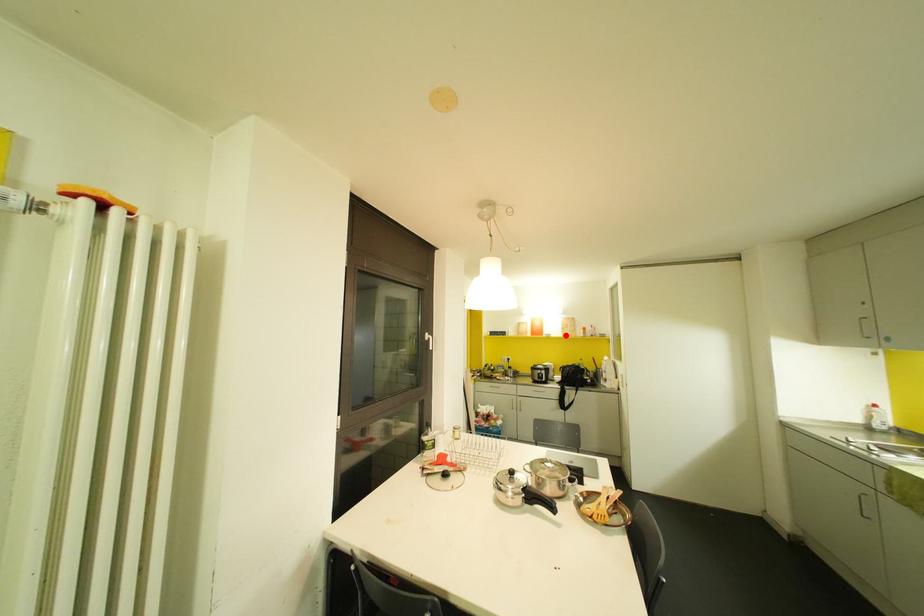
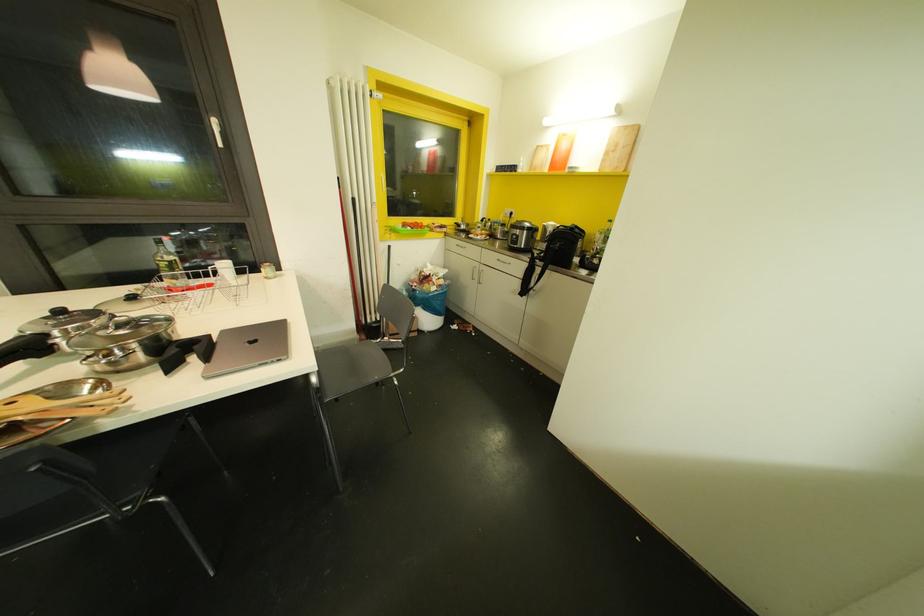
Locate, in the second image, the point that corresponds to the highlighted location in the first image.

(606, 169)